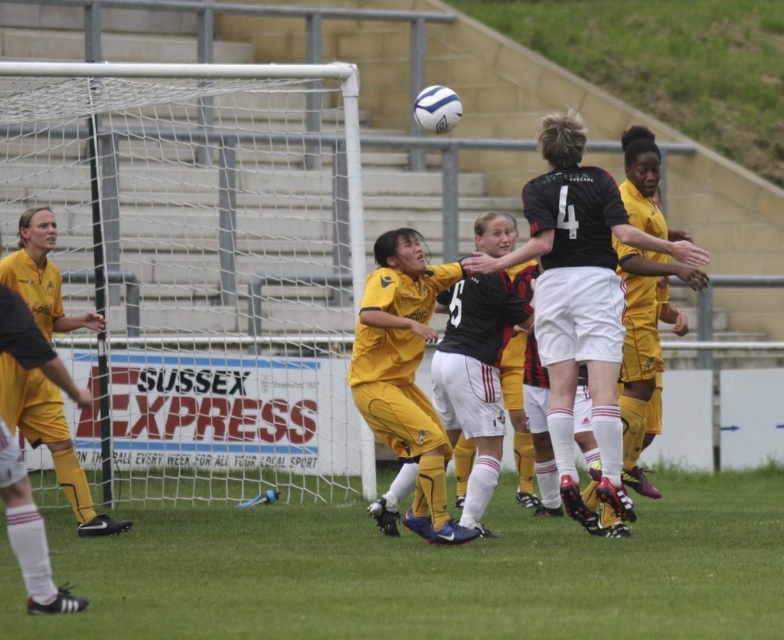
Does point (209, 582) come farther from viewer compared to point (26, 372)?

No, it is in front of (26, 372).

Does green grass at lower center have a larger size compared to yellow jersey at left?

Yes, green grass at lower center is bigger than yellow jersey at left.

Consider the image. Measure the distance between point (771,490) and camera.

They are 62.38 feet apart.

The height and width of the screenshot is (640, 784). In order to click on green grass at lower center in this screenshot , I will do `click(426, 572)`.

Between white mesh net at center and green grass at lower center, which one has less height?

green grass at lower center

Does white mesh net at center appear under green grass at lower center?

Incorrect, white mesh net at center is not positioned below green grass at lower center.

Which is behind, point (118, 298) or point (164, 577)?

The point (118, 298) is behind.

Where is `white mesh net at center`? This screenshot has height=640, width=784. white mesh net at center is located at coordinates pos(200,269).

Is yellow jersey at center to the right of yellow jersey at left from the viewer's perspective?

Yes, yellow jersey at center is to the right of yellow jersey at left.

Image resolution: width=784 pixels, height=640 pixels. Identify the location of yellow jersey at center. (579, 294).

Describe the element at coordinates (579, 294) in the screenshot. This screenshot has width=784, height=640. I see `yellow jersey at center` at that location.

Where is `yellow jersey at center`? The width and height of the screenshot is (784, 640). yellow jersey at center is located at coordinates (x=579, y=294).